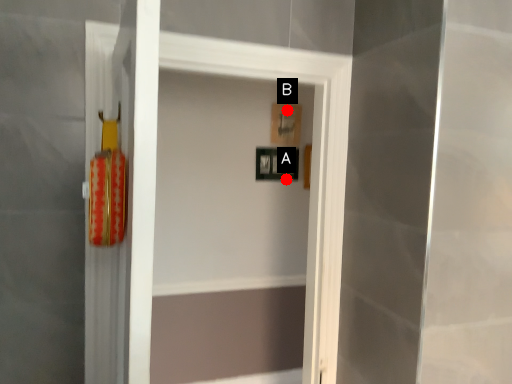
Question: Two points are circled on the image, labeled by A and B beside each circle. Which of the following is the farthest from the observer?

Choices:
 (A) A is further
 (B) B is further

Answer: (A)